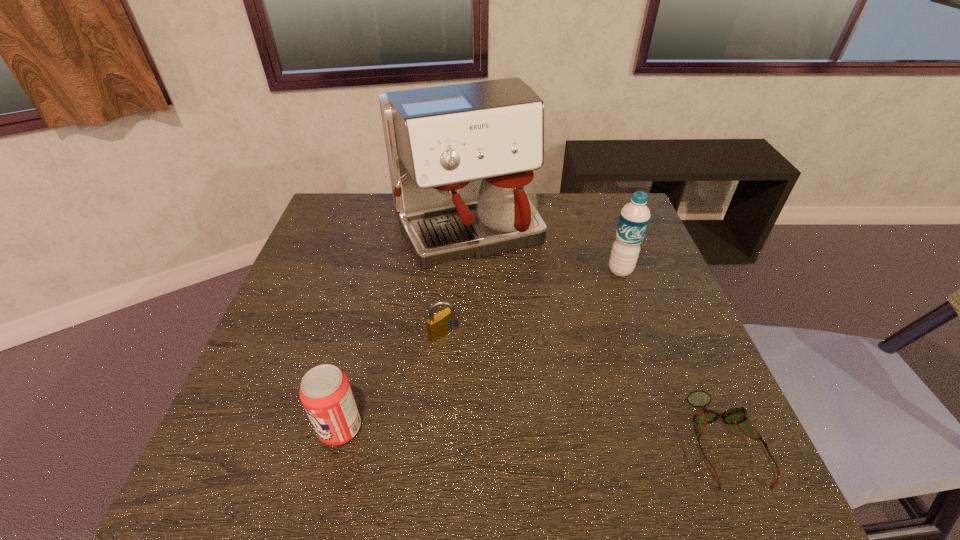
The width and height of the screenshot is (960, 540). In the image, there is a desktop. Identify the location of vacant space at the near right corner. (725, 436).

Find the location of a particular element. The image size is (960, 540). empty space between the coffee maker and the padlock is located at coordinates (455, 283).

At what (x,y) coordinates should I click in order to perform the action: click on vacant space in between the second shortest object and the second tallest object. Please return your answer as a coordinate pair (x, y). The width and height of the screenshot is (960, 540). Looking at the image, I should click on point(532,302).

This screenshot has width=960, height=540. What are the coordinates of `vacant space that is in between the soda can and the third nearest object` in the screenshot? It's located at (392, 381).

Where is `free space between the second shortest object and the spectacles`? This screenshot has width=960, height=540. free space between the second shortest object and the spectacles is located at coordinates (584, 388).

Find the location of `vacant space that is in between the coffee maker and the water bottle`. vacant space that is in between the coffee maker and the water bottle is located at coordinates (543, 251).

Locate an element on the screen. The height and width of the screenshot is (540, 960). unoccupied area between the coffee maker and the third tallest object is located at coordinates (404, 330).

I want to click on vacant area between the second tallest object and the tallest object, so click(x=543, y=251).

Find the location of a particular element. Image resolution: width=960 pixels, height=540 pixels. vacant area between the soda can and the fourth tallest object is located at coordinates (392, 381).

The width and height of the screenshot is (960, 540). In order to click on free spot between the shortest object and the fourth shortest object in this screenshot , I will do `click(672, 356)`.